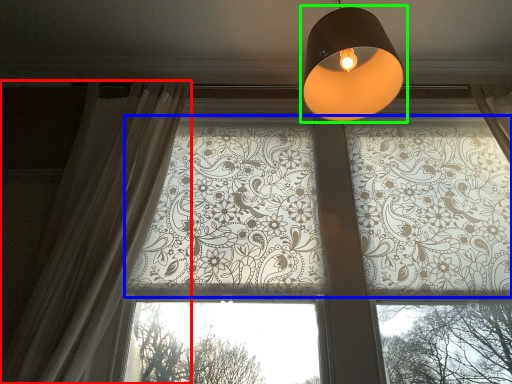
Question: Considering the real-world distances, which object is closest to curtain (highlighted by a red box)? bay window (highlighted by a blue box) or lamp (highlighted by a green box).

Choices:
 (A) bay window
 (B) lamp

Answer: (A)